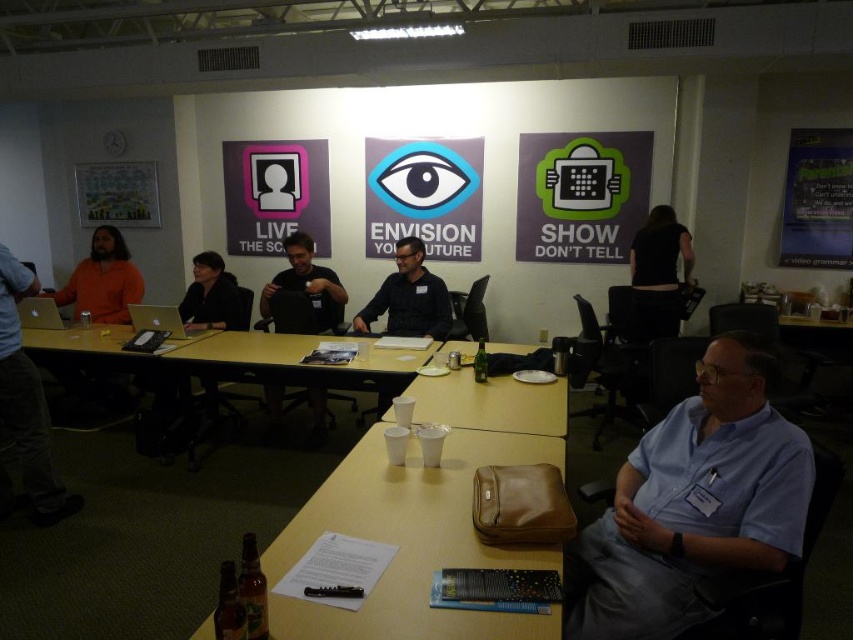
Is yellow matte table at center in front of white plastic cups at center?

Yes, yellow matte table at center is closer to the viewer.

In the scene shown: Who is shorter, yellow matte table at center or white plastic cups at center?

With less height is yellow matte table at center.

Between point (299, 628) and point (457, 381), which one is positioned behind?

The point (457, 381) is behind.

Identify the location of yellow matte table at center. The height and width of the screenshot is (640, 853). (409, 540).

Is point (146, 362) positioned in front of point (146, 312)?

Yes, point (146, 362) is in front of point (146, 312).

Is wooden table at center smaller than silver metallic laptop at center?

Incorrect, wooden table at center is not smaller in size than silver metallic laptop at center.

Is point (96, 340) behind point (171, 321)?

Yes, it is behind point (171, 321).

Find the location of `wooden table at center`. wooden table at center is located at coordinates (136, 378).

From the picture: Is the position of yellow matte table at center more distant than that of wooden table at center?

No, yellow matte table at center is closer to the viewer.

Which is behind, point (463, 454) or point (155, 436)?

The point (155, 436) is more distant.

Describe the element at coordinates (409, 540) in the screenshot. I see `yellow matte table at center` at that location.

Where is `yellow matte table at center`? This screenshot has width=853, height=640. yellow matte table at center is located at coordinates (409, 540).